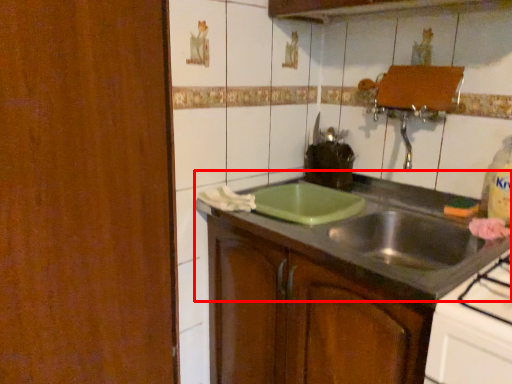
Question: In this image, where is countertop (annotated by the red box) located relative to cabinetry?

Choices:
 (A) right
 (B) left

Answer: (A)